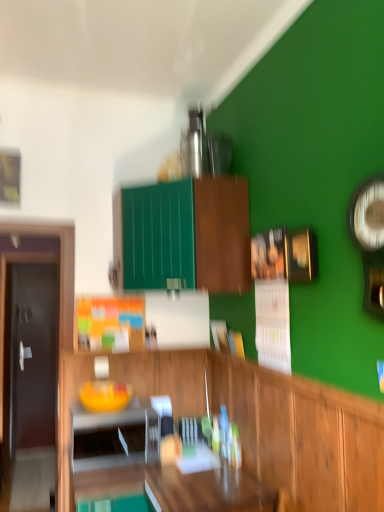
Question: Looking at the image, does wooden cabinet at center, the 2th cabinetry positioned from the top, seem bigger or smaller compared to wooden table at center?

Choices:
 (A) small
 (B) big

Answer: (A)

Question: In the image, is wooden cabinet at center, the 2th cabinetry positioned from the top, positioned in front of or behind wooden table at center?

Choices:
 (A) behind
 (B) front

Answer: (B)

Question: Based on their relative distances, which object is nearer to the wooden table at center?

Choices:
 (A) dark brown wooden door at left
 (B) white glossy microwave at lower left
 (C) metallic silver clock at right
 (D) wooden cabinet at center, placed as the 1th cabinetry when sorted from bottom to top
 (E) green matte cabinet at upper center, the second cabinetry positioned from the bottom

Answer: (B)

Question: Which of these objects is positioned farthest from the wooden cabinet at center, placed as the 1th cabinetry when sorted from bottom to top?

Choices:
 (A) dark brown wooden door at left
 (B) metallic silver clock at right
 (C) white glossy microwave at lower left
 (D) green matte cabinet at upper center, the second cabinetry positioned from the bottom
 (E) wooden table at center

Answer: (A)